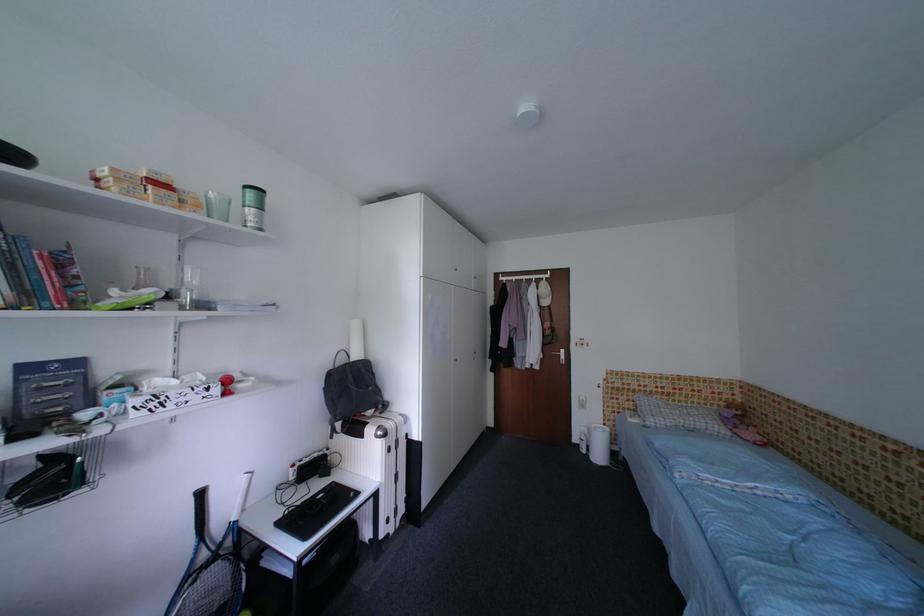
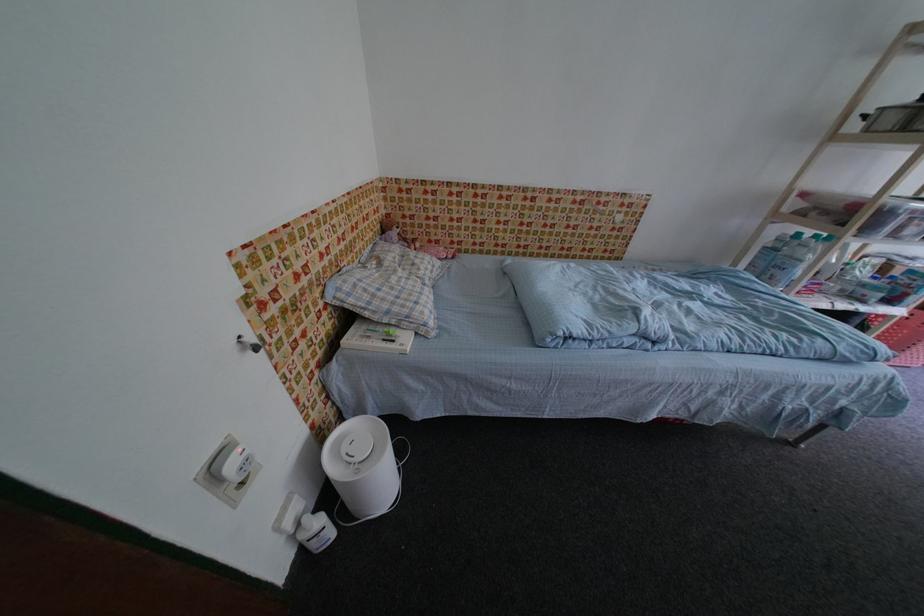
The point at [690,400] is marked in the first image. Where is the corresponding point in the second image?

(370, 246)